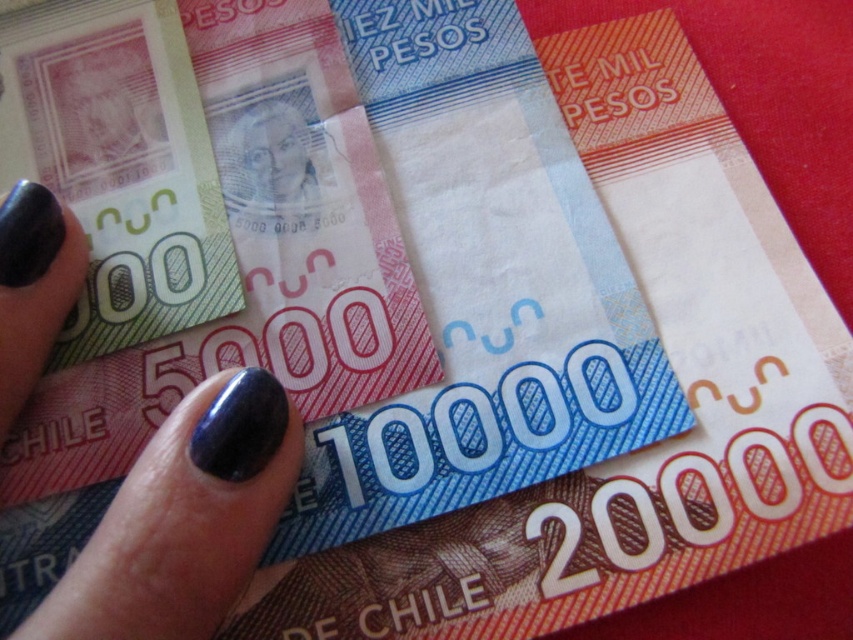
You are organizing a desk and see both the nail polish at center and the smooth paper money at center. Which item is closer to you?

The nail polish at center is closer to you since it is in front of the smooth paper money at center.

Based on the photo, you are organizing a makeup station and see two nail polishes in the image. The nail polish at center and the nail polish at lower left. Based on their positions, which nail polish is located to the right of the other?

The nail polish at center is to the right of the nail polish at lower left.